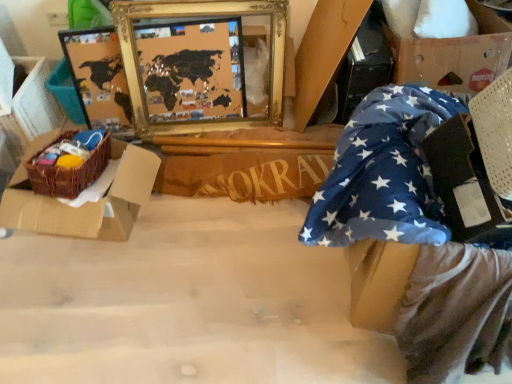
Question: Does brown woven basket at left have a smaller size compared to wooden sign at center?

Choices:
 (A) yes
 (B) no

Answer: (A)

Question: Is brown woven basket at left placed right next to wooden sign at center?

Choices:
 (A) yes
 (B) no

Answer: (B)

Question: Is brown woven basket at left to the right of wooden sign at center from the viewer's perspective?

Choices:
 (A) no
 (B) yes

Answer: (A)

Question: Does brown woven basket at left have a greater width compared to wooden sign at center?

Choices:
 (A) no
 (B) yes

Answer: (B)

Question: Can you confirm if brown woven basket at left is positioned to the left of wooden sign at center?

Choices:
 (A) yes
 (B) no

Answer: (A)

Question: Is cardboard box at upper right, which ranks as the second cardboard box in left-to-right order, taller or shorter than gold-framed map at upper center?

Choices:
 (A) tall
 (B) short

Answer: (B)

Question: From a real-world perspective, relative to gold-framed map at upper center, is cardboard box at upper right, placed as the 1th cardboard box when sorted from right to left, vertically above or below?

Choices:
 (A) above
 (B) below

Answer: (A)

Question: Does point (424, 69) appear closer or farther from the camera than point (279, 84)?

Choices:
 (A) farther
 (B) closer

Answer: (B)

Question: Is cardboard box at upper right, placed as the 1th cardboard box when sorted from right to left, situated inside gold-framed map at upper center or outside?

Choices:
 (A) outside
 (B) inside

Answer: (A)

Question: Looking at the image, does blue star-patterned fabric at lower right seem bigger or smaller compared to wooden sign at center?

Choices:
 (A) big
 (B) small

Answer: (A)

Question: Considering their positions, is blue star-patterned fabric at lower right located in front of or behind wooden sign at center?

Choices:
 (A) front
 (B) behind

Answer: (A)

Question: Visually, is blue star-patterned fabric at lower right positioned to the left or to the right of wooden sign at center?

Choices:
 (A) left
 (B) right

Answer: (B)

Question: In terms of height, does blue star-patterned fabric at lower right look taller or shorter compared to wooden sign at center?

Choices:
 (A) short
 (B) tall

Answer: (B)

Question: Considering the positions of point coord(307,155) and point coord(329,59), is point coord(307,155) closer or farther from the camera than point coord(329,59)?

Choices:
 (A) farther
 (B) closer

Answer: (B)

Question: In terms of width, does wooden sign at center look wider or thinner when compared to blue fabric at right, placed as the second cardboard box when sorted from right to left?

Choices:
 (A) thin
 (B) wide

Answer: (A)